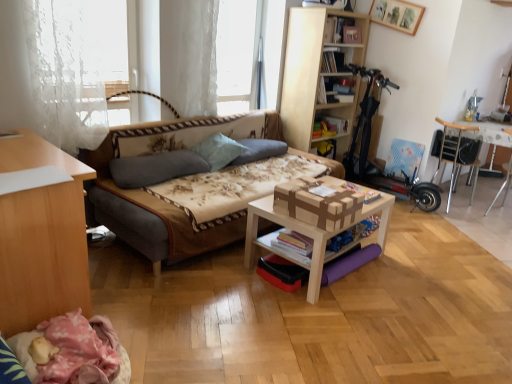
Question: Can you confirm if gray fabric pillow at center, the third pillow positioned from the right, is shorter than hardcover book at upper center, which ranks as the 2th book in back-to-front order?

Choices:
 (A) yes
 (B) no

Answer: (A)

Question: Is gray fabric pillow at center, the 1th pillow when ordered from left to right, with hardcover book at upper center, which ranks as the 2th book in back-to-front order?

Choices:
 (A) yes
 (B) no

Answer: (B)

Question: From a real-world perspective, is gray fabric pillow at center, the 1th pillow when ordered from left to right, physically below hardcover book at upper center, which ranks as the 2th book in back-to-front order?

Choices:
 (A) no
 (B) yes

Answer: (B)

Question: Does gray fabric pillow at center, the third pillow positioned from the right, appear on the left side of hardcover book at upper center, which ranks as the 2th book in top-to-bottom order?

Choices:
 (A) yes
 (B) no

Answer: (A)

Question: From the image's perspective, would you say gray fabric pillow at center, the 1th pillow when ordered from left to right, is positioned over hardcover book at upper center, acting as the third book starting from the bottom?

Choices:
 (A) no
 (B) yes

Answer: (A)

Question: Is gray fabric pillow at center, the 1th pillow when ordered from left to right, oriented away from hardcover book at upper center, which ranks as the 2th book in top-to-bottom order?

Choices:
 (A) yes
 (B) no

Answer: (B)

Question: Is white lace curtain at upper center in contact with gray fabric pillow at center, the third pillow positioned from the right?

Choices:
 (A) yes
 (B) no

Answer: (B)

Question: Considering the relative sizes of white lace curtain at upper center and gray fabric pillow at center, the 1th pillow when ordered from left to right, in the image provided, is white lace curtain at upper center thinner than gray fabric pillow at center, the 1th pillow when ordered from left to right,?

Choices:
 (A) no
 (B) yes

Answer: (A)

Question: Can we say white lace curtain at upper center lies outside gray fabric pillow at center, the third pillow positioned from the right?

Choices:
 (A) yes
 (B) no

Answer: (A)

Question: Can you confirm if white lace curtain at upper center is taller than gray fabric pillow at center, the 1th pillow when ordered from left to right?

Choices:
 (A) yes
 (B) no

Answer: (A)

Question: Is white lace curtain at upper center positioned before gray fabric pillow at center, the third pillow positioned from the right?

Choices:
 (A) no
 (B) yes

Answer: (A)

Question: Does white lace curtain at upper center have a lesser height compared to gray fabric pillow at center, the third pillow positioned from the right?

Choices:
 (A) no
 (B) yes

Answer: (A)

Question: From a real-world perspective, is floral fabric studio couch at center under white lace curtain at upper center?

Choices:
 (A) no
 (B) yes

Answer: (B)